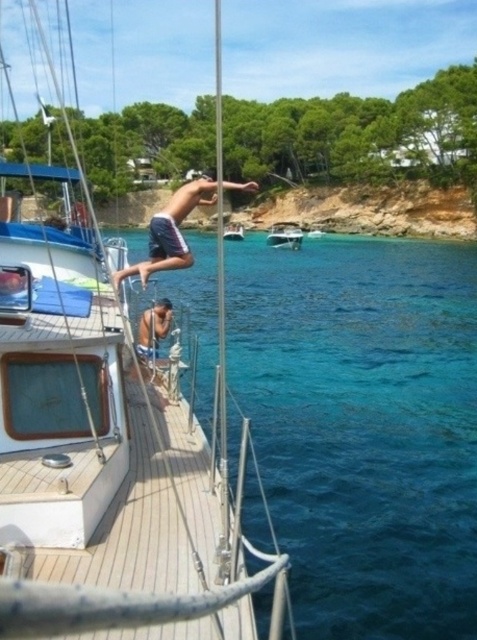
Between clear blue water at center and wooden sailboat at center, which one appears on the right side from the viewer's perspective?

clear blue water at center is more to the right.

Does clear blue water at center have a smaller size compared to wooden sailboat at center?

Incorrect, clear blue water at center is not smaller in size than wooden sailboat at center.

Which is behind, point (473, 324) or point (232, 225)?

Point (232, 225)

Find the location of a particular element. The width and height of the screenshot is (477, 640). clear blue water at center is located at coordinates (363, 426).

Between point (217, 182) and point (242, 230), which one is positioned in front?

Point (217, 182)

Is dark blue shorts at center bigger than wooden sailboat at center?

Yes.

Between point (189, 193) and point (242, 237), which one is positioned behind?

Positioned behind is point (242, 237).

The image size is (477, 640). I want to click on dark blue shorts at center, so click(172, 230).

Does wooden sailboat at left have a smaller size compared to white glossy boat at center?

Incorrect, wooden sailboat at left is not smaller in size than white glossy boat at center.

Locate an element on the screen. Image resolution: width=477 pixels, height=640 pixels. wooden sailboat at left is located at coordinates (105, 458).

Is point (172, 577) closer to camera compared to point (283, 230)?

Yes, point (172, 577) is closer to viewer.

Identify the location of wooden sailboat at left. (105, 458).